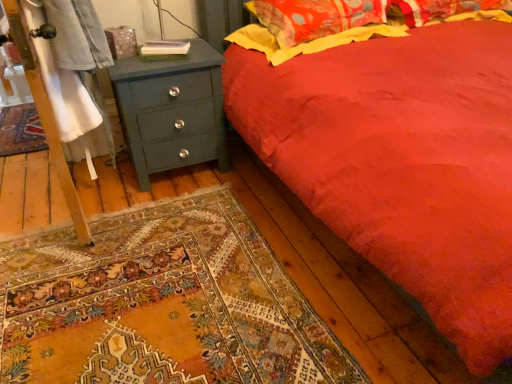
Describe the element at coordinates (315, 17) in the screenshot. I see `fluffy cotton pillow at upper right` at that location.

Find the location of a particular element. fluffy cotton pillow at upper right is located at coordinates (315, 17).

Identify the location of teal painted wood chest of drawers at left. (172, 111).

Image resolution: width=512 pixels, height=384 pixels. What do you see at coordinates (172, 111) in the screenshot?
I see `teal painted wood chest of drawers at left` at bounding box center [172, 111].

The height and width of the screenshot is (384, 512). In order to click on fluffy cotton pillow at upper right in this screenshot , I will do `click(315, 17)`.

Is teal painted wood chest of drawers at left at the right side of fluffy cotton pillow at upper right?

No, teal painted wood chest of drawers at left is not to the right of fluffy cotton pillow at upper right.

Considering the positions of objects teal painted wood chest of drawers at left and fluffy cotton pillow at upper right in the image provided, who is in front, teal painted wood chest of drawers at left or fluffy cotton pillow at upper right?

teal painted wood chest of drawers at left is closer to the camera.

Considering the positions of points (149, 139) and (311, 14), is point (149, 139) farther from camera compared to point (311, 14)?

Yes, point (149, 139) is farther from viewer.

From the image's perspective, relative to fluffy cotton pillow at upper right, is teal painted wood chest of drawers at left above or below?

From the image's perspective, teal painted wood chest of drawers at left appears below fluffy cotton pillow at upper right.

From a real-world perspective, which is physically above, teal painted wood chest of drawers at left or fluffy cotton pillow at upper right?

fluffy cotton pillow at upper right.

From the picture: Which of these two, teal painted wood chest of drawers at left or fluffy cotton pillow at upper right, is wider?

With larger width is fluffy cotton pillow at upper right.

Is teal painted wood chest of drawers at left taller or shorter than fluffy cotton pillow at upper right?

Clearly, teal painted wood chest of drawers at left is taller compared to fluffy cotton pillow at upper right.

Looking at the image, does teal painted wood chest of drawers at left seem bigger or smaller compared to fluffy cotton pillow at upper right?

teal painted wood chest of drawers at left is bigger than fluffy cotton pillow at upper right.

Is teal painted wood chest of drawers at left positioned beyond the bounds of fluffy cotton pillow at upper right?

Yes, teal painted wood chest of drawers at left is not within fluffy cotton pillow at upper right.

Are teal painted wood chest of drawers at left and fluffy cotton pillow at upper right far apart?

No.

Is fluffy cotton pillow at upper right at the back of teal painted wood chest of drawers at left?

No, fluffy cotton pillow at upper right is not at the back of teal painted wood chest of drawers at left.

How different are the orientations of teal painted wood chest of drawers at left and fluffy cotton pillow at upper right in degrees?

teal painted wood chest of drawers at left and fluffy cotton pillow at upper right are facing 0.0784 degrees away from each other.

Locate an element on the screen. This screenshot has width=512, height=384. pillow behind the teal painted wood chest of drawers at left is located at coordinates (315, 17).

Which is more to the left, fluffy cotton pillow at upper right or teal painted wood chest of drawers at left?

Positioned to the left is teal painted wood chest of drawers at left.

Considering the positions of objects fluffy cotton pillow at upper right and teal painted wood chest of drawers at left in the image provided, who is in front, fluffy cotton pillow at upper right or teal painted wood chest of drawers at left?

teal painted wood chest of drawers at left is closer to the camera.

Between point (298, 42) and point (206, 104), which one is positioned in front?

The point (298, 42) is closer.

Consider the image. From the image's perspective, is fluffy cotton pillow at upper right located above or below teal painted wood chest of drawers at left?

Based on their image positions, fluffy cotton pillow at upper right is located above teal painted wood chest of drawers at left.

From a real-world perspective, is fluffy cotton pillow at upper right on top of teal painted wood chest of drawers at left?

Yes, from a real-world perspective, fluffy cotton pillow at upper right is above teal painted wood chest of drawers at left.

Can you confirm if fluffy cotton pillow at upper right is wider than teal painted wood chest of drawers at left?

Correct, the width of fluffy cotton pillow at upper right exceeds that of teal painted wood chest of drawers at left.

Considering the sizes of fluffy cotton pillow at upper right and teal painted wood chest of drawers at left in the image, is fluffy cotton pillow at upper right taller or shorter than teal painted wood chest of drawers at left?

In the image, fluffy cotton pillow at upper right appears to be shorter than teal painted wood chest of drawers at left.

Who is bigger, fluffy cotton pillow at upper right or teal painted wood chest of drawers at left?

Bigger between the two is teal painted wood chest of drawers at left.

Is fluffy cotton pillow at upper right not within teal painted wood chest of drawers at left?

fluffy cotton pillow at upper right is positioned outside teal painted wood chest of drawers at left.

Are fluffy cotton pillow at upper right and teal painted wood chest of drawers at left beside each other?

No, fluffy cotton pillow at upper right is not beside teal painted wood chest of drawers at left.

Is fluffy cotton pillow at upper right facing away from teal painted wood chest of drawers at left?

fluffy cotton pillow at upper right does not have its back to teal painted wood chest of drawers at left.

In the image, there is a fluffy cotton pillow at upper right. Where is `the chest of drawers below it (from a real-world perspective)`? the chest of drawers below it (from a real-world perspective) is located at coordinates (172, 111).

The width and height of the screenshot is (512, 384). Find the location of `pillow above the teal painted wood chest of drawers at left (from a real-world perspective)`. pillow above the teal painted wood chest of drawers at left (from a real-world perspective) is located at coordinates (315, 17).

The image size is (512, 384). In the image, there is a fluffy cotton pillow at upper right. Identify the location of the chest of drawers below it (from a real-world perspective). [x=172, y=111].